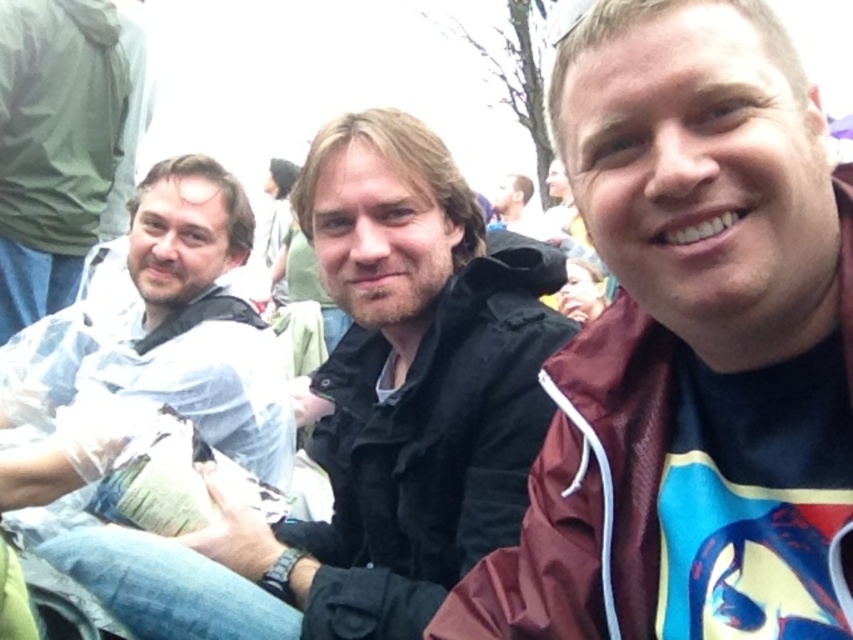
Question: Is maroon fabric jacket at right thinner than white plastic bag at left?

Choices:
 (A) no
 (B) yes

Answer: (B)

Question: Which object appears farthest from the camera in this image?

Choices:
 (A) maroon fabric jacket at right
 (B) matte black jacket at center
 (C) white plastic bag at left

Answer: (C)

Question: Estimate the real-world distances between objects in this image. Which object is closer to the white plastic bag at left?

Choices:
 (A) maroon fabric jacket at right
 (B) matte black jacket at center

Answer: (B)

Question: Which point is farther to the camera?

Choices:
 (A) matte black jacket at center
 (B) white plastic bag at left
 (C) maroon fabric jacket at right

Answer: (B)

Question: Can you confirm if maroon fabric jacket at right is wider than matte black jacket at center?

Choices:
 (A) no
 (B) yes

Answer: (A)

Question: Is maroon fabric jacket at right in front of white plastic bag at left?

Choices:
 (A) yes
 (B) no

Answer: (A)